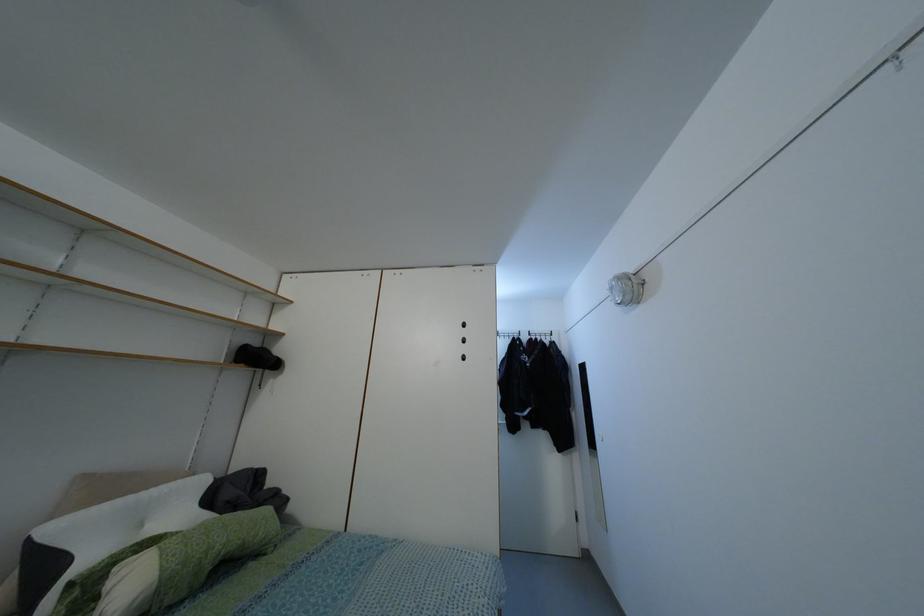
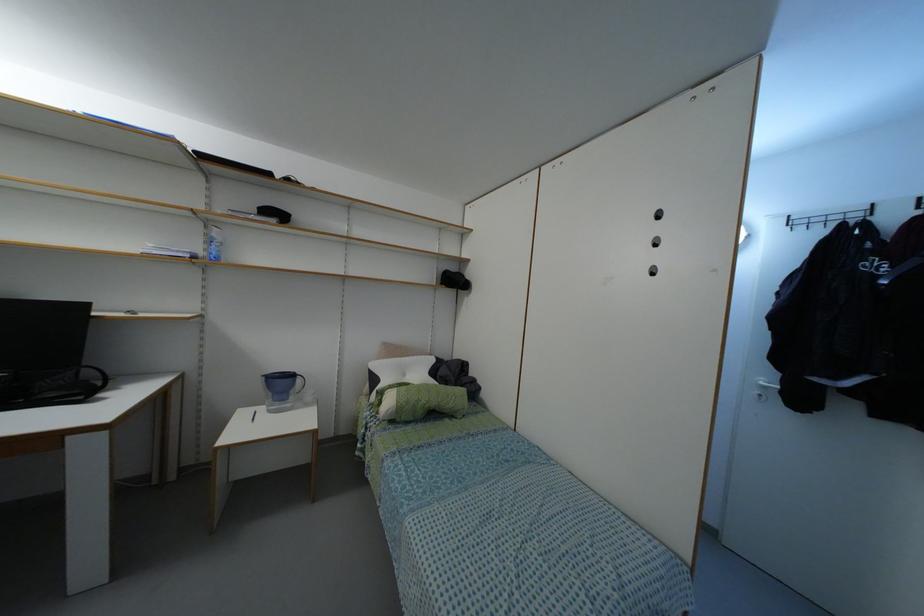
Question: The first image is from the beginning of the video and the second image is from the end. How did the camera likely rotate when shooting the video?

Choices:
 (A) Left
 (B) Right
 (C) Up
 (D) Down

Answer: (A)